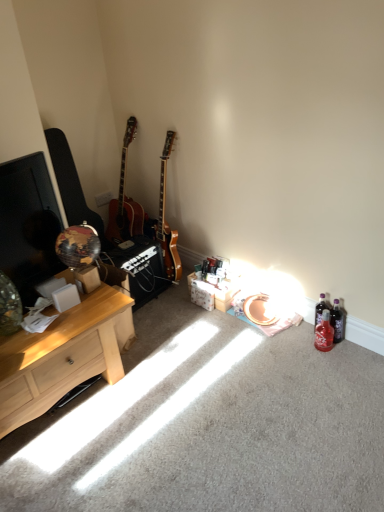
The width and height of the screenshot is (384, 512). What do you see at coordinates (324, 333) in the screenshot?
I see `red glass bottle at lower right, which is the 2th bottle from back to front` at bounding box center [324, 333].

Consider the image. What is the approximate height of red glass bottle at lower right, acting as the first bottle starting from the front?

9.12 inches.

Measure the distance between white plastic power outlet at upper center and camera.

The distance of white plastic power outlet at upper center from camera is 3.06 meters.

Describe the element at coordinates (84, 197) in the screenshot. I see `matte black guitar at left` at that location.

Locate an element on the screen. This screenshot has height=512, width=384. red glass bottle at lower right, acting as the first bottle starting from the front is located at coordinates (324, 333).

Can we say light wood desk at left lies outside white plastic power outlet at upper center?

light wood desk at left is positioned outside white plastic power outlet at upper center.

Looking at this image, can you confirm if light wood desk at left is wider than white plastic power outlet at upper center?

Yes.

From a real-world perspective, which is physically below, light wood desk at left or white plastic power outlet at upper center?

light wood desk at left is physically lower.

How much distance is there between light wood desk at left and white plastic power outlet at upper center?

A: The distance of light wood desk at left from white plastic power outlet at upper center is 4.56 feet.

Does translucent plastic bottle at lower right, marked as the first bottle in a back-to-front arrangement, appear on the right side of red glass bottle at lower right, which is the 2th bottle from back to front?

Yes, translucent plastic bottle at lower right, marked as the first bottle in a back-to-front arrangement, is to the right of red glass bottle at lower right, which is the 2th bottle from back to front.

Would you say translucent plastic bottle at lower right, placed as the second bottle when sorted from front to back, is inside or outside red glass bottle at lower right, which is the 2th bottle from back to front?

translucent plastic bottle at lower right, placed as the second bottle when sorted from front to back, exists outside the volume of red glass bottle at lower right, which is the 2th bottle from back to front.

From a real-world perspective, is translucent plastic bottle at lower right, marked as the first bottle in a back-to-front arrangement, below red glass bottle at lower right, which is the 2th bottle from back to front?

No, from a real-world perspective, translucent plastic bottle at lower right, marked as the first bottle in a back-to-front arrangement, is not under red glass bottle at lower right, which is the 2th bottle from back to front.

The image size is (384, 512). In order to click on bottle that appears on the left of translucent plastic bottle at lower right, marked as the first bottle in a back-to-front arrangement in this screenshot , I will do `click(324, 333)`.

Are matte black guitar at left and red glass bottle at lower right, which is the 2th bottle from back to front, located far from each other?

Indeed, matte black guitar at left is not near red glass bottle at lower right, which is the 2th bottle from back to front.

Considering the sizes of matte black guitar at left and red glass bottle at lower right, acting as the first bottle starting from the front, in the image, is matte black guitar at left taller or shorter than red glass bottle at lower right, acting as the first bottle starting from the front,?

Clearly, matte black guitar at left is taller compared to red glass bottle at lower right, acting as the first bottle starting from the front.

Measure the distance between matte black guitar at left and red glass bottle at lower right, which is the 2th bottle from back to front.

matte black guitar at left and red glass bottle at lower right, which is the 2th bottle from back to front, are 5.01 feet apart.

Which is correct: matte black guitar at left is inside red glass bottle at lower right, acting as the first bottle starting from the front, or outside of it?

The correct answer is: outside.

Is light wood desk at left in front of or behind translucent plastic bottle at lower right, marked as the first bottle in a back-to-front arrangement, in the image?

Clearly, light wood desk at left is in front of translucent plastic bottle at lower right, marked as the first bottle in a back-to-front arrangement.

From the image's perspective, does light wood desk at left appear higher than translucent plastic bottle at lower right, placed as the second bottle when sorted from front to back?

Actually, light wood desk at left appears below translucent plastic bottle at lower right, placed as the second bottle when sorted from front to back, in the image.

From a real-world perspective, which object rests below the other?

In real-world perspective, translucent plastic bottle at lower right, marked as the first bottle in a back-to-front arrangement, is lower.

Which object is wider, light wood desk at left or translucent plastic bottle at lower right, placed as the second bottle when sorted from front to back?

light wood desk at left.

Is light wood desk at left a part of matte black guitar at left?

No, matte black guitar at left does not contain light wood desk at left.

Looking at the image, does matte black guitar at left seem bigger or smaller compared to light wood desk at left?

In the image, matte black guitar at left appears to be smaller than light wood desk at left.

From a real-world perspective, between matte black guitar at left and light wood desk at left, who is vertically lower?

In real-world perspective, light wood desk at left is lower.

Is matte black guitar at left not close to light wood desk at left?

That's not correct — matte black guitar at left is a little close to light wood desk at left.

Is light wood desk at left far away from red glass bottle at lower right, acting as the first bottle starting from the front?

Yes, light wood desk at left and red glass bottle at lower right, acting as the first bottle starting from the front, are quite far apart.

In terms of width, does light wood desk at left look wider or thinner when compared to red glass bottle at lower right, acting as the first bottle starting from the front?

Clearly, light wood desk at left has more width compared to red glass bottle at lower right, acting as the first bottle starting from the front.

Considering the sizes of objects light wood desk at left and red glass bottle at lower right, acting as the first bottle starting from the front, in the image provided, who is taller, light wood desk at left or red glass bottle at lower right, acting as the first bottle starting from the front,?

light wood desk at left is taller.

Considering the sizes of objects white plastic power outlet at upper center and matte black guitar at left in the image provided, who is smaller, white plastic power outlet at upper center or matte black guitar at left?

Smaller between the two is white plastic power outlet at upper center.

Looking at this image, is white plastic power outlet at upper center not near matte black guitar at left?

white plastic power outlet at upper center is near matte black guitar at left, not far away.

From the image's perspective, which is above, white plastic power outlet at upper center or matte black guitar at left?

white plastic power outlet at upper center.

In terms of width, does white plastic power outlet at upper center look wider or thinner when compared to matte black guitar at left?

Considering their sizes, white plastic power outlet at upper center looks slimmer than matte black guitar at left.

The image size is (384, 512). In order to click on power outlet behind the light wood desk at left in this screenshot , I will do `click(103, 198)`.

Locate an element on the screen. This screenshot has height=512, width=384. bottle on the left of translucent plastic bottle at lower right, placed as the second bottle when sorted from front to back is located at coordinates (324, 333).

Considering their positions, is white plastic power outlet at upper center positioned closer to matte black guitar at left than translucent plastic bottle at lower right, placed as the second bottle when sorted from front to back?

white plastic power outlet at upper center is positioned closer to the anchor matte black guitar at left.

Looking at the image, which one is located closer to red glass bottle at lower right, acting as the first bottle starting from the front, white plastic power outlet at upper center or translucent plastic bottle at lower right, placed as the second bottle when sorted from front to back?

The object closer to red glass bottle at lower right, acting as the first bottle starting from the front, is translucent plastic bottle at lower right, placed as the second bottle when sorted from front to back.

When comparing their distances from light wood desk at left, does red glass bottle at lower right, acting as the first bottle starting from the front, or matte black guitar at left seem further?

red glass bottle at lower right, acting as the first bottle starting from the front, lies further to light wood desk at left than the other object.

Which object lies further to the anchor point translucent plastic bottle at lower right, marked as the first bottle in a back-to-front arrangement, white plastic power outlet at upper center or light wood desk at left?

Among the two, white plastic power outlet at upper center is located further to translucent plastic bottle at lower right, marked as the first bottle in a back-to-front arrangement.

From the image, which object appears to be nearer to translucent plastic bottle at lower right, marked as the first bottle in a back-to-front arrangement, white plastic power outlet at upper center or matte black guitar at left?

The object closer to translucent plastic bottle at lower right, marked as the first bottle in a back-to-front arrangement, is matte black guitar at left.

Considering their positions, is red glass bottle at lower right, acting as the first bottle starting from the front, positioned closer to light wood desk at left than white plastic power outlet at upper center?

Among the two, red glass bottle at lower right, acting as the first bottle starting from the front, is located nearer to light wood desk at left.

Estimate the real-world distances between objects in this image. Which object is closer to red glass bottle at lower right, which is the 2th bottle from back to front, translucent plastic bottle at lower right, marked as the first bottle in a back-to-front arrangement, or light wood desk at left?

translucent plastic bottle at lower right, marked as the first bottle in a back-to-front arrangement, lies closer to red glass bottle at lower right, which is the 2th bottle from back to front, than the other object.

Estimate the real-world distances between objects in this image. Which object is closer to translucent plastic bottle at lower right, placed as the second bottle when sorted from front to back, white plastic power outlet at upper center or red glass bottle at lower right, which is the 2th bottle from back to front?

red glass bottle at lower right, which is the 2th bottle from back to front, lies closer to translucent plastic bottle at lower right, placed as the second bottle when sorted from front to back, than the other object.

The image size is (384, 512). Identify the location of guitars between light wood desk at left and white plastic power outlet at upper center in the front-back direction. (84, 197).

Locate an element on the screen. The image size is (384, 512). guitars between light wood desk at left and red glass bottle at lower right, which is the 2th bottle from back to front, in the horizontal direction is located at coordinates (84, 197).

The height and width of the screenshot is (512, 384). Identify the location of power outlet situated between light wood desk at left and red glass bottle at lower right, which is the 2th bottle from back to front, from left to right. (103, 198).

At what (x,y) coordinates should I click in order to perform the action: click on bottle between light wood desk at left and translucent plastic bottle at lower right, placed as the second bottle when sorted from front to back, in the horizontal direction. Please return your answer as a coordinate pair (x, y). This screenshot has width=384, height=512. Looking at the image, I should click on (324, 333).